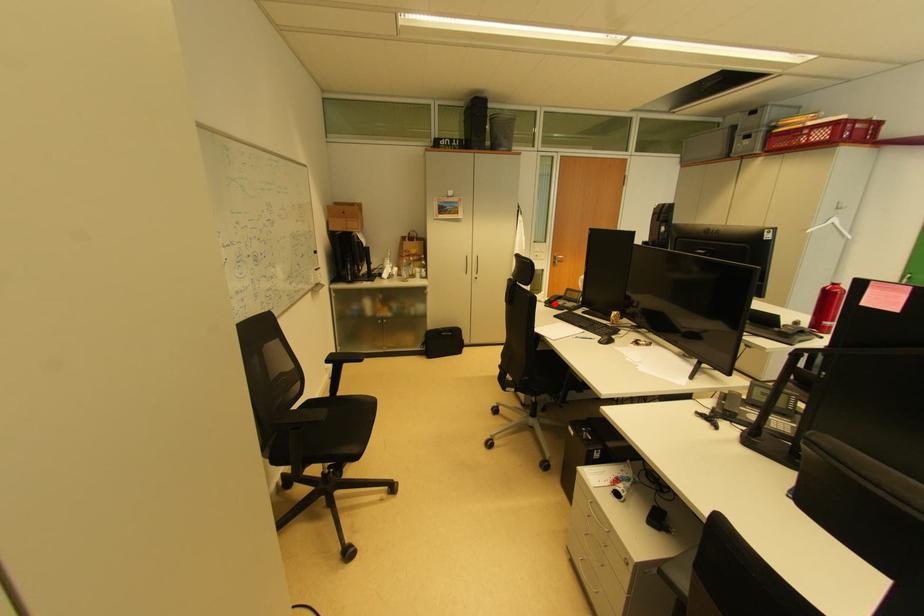
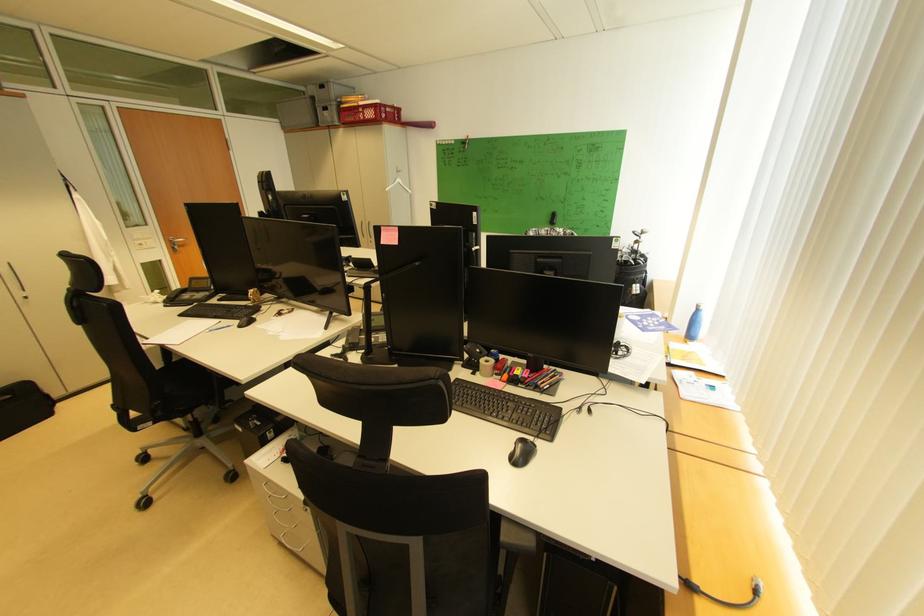
The point at the highlighted location is marked in the first image. Where is the corresponding point in the second image?

(174, 302)